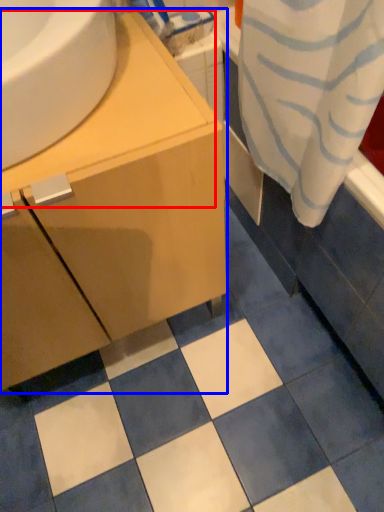
Question: Which object appears farthest to the camera in this image, counter top (highlighted by a red box) or bathroom cabinet (highlighted by a blue box)?

Choices:
 (A) counter top
 (B) bathroom cabinet

Answer: (B)